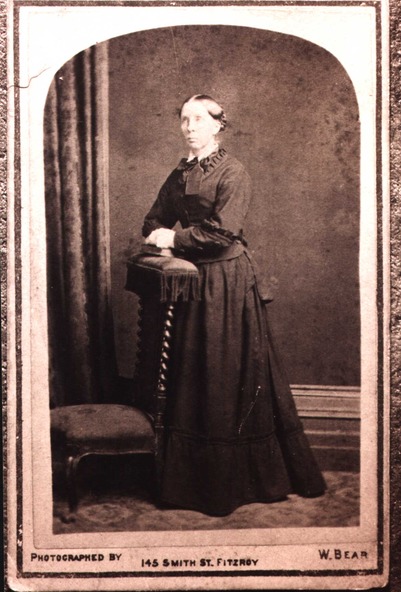
Find the location of `bible`. bible is located at coordinates (163, 249).